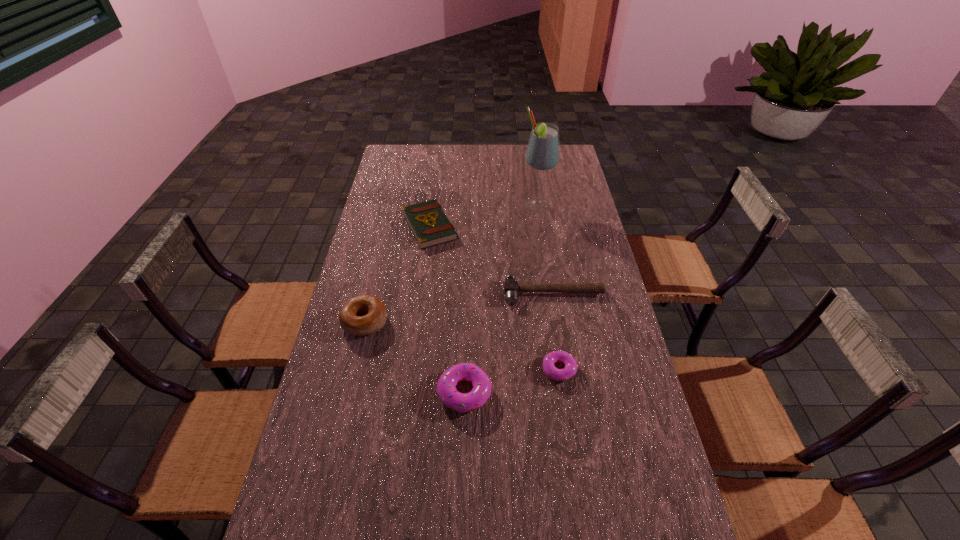
Find the location of a particular element. This screenshot has height=540, width=960. free space at the right edge is located at coordinates (617, 462).

At what (x,y) coordinates should I click in order to perform the action: click on free space at the far left corner of the desktop. Please return your answer as a coordinate pair (x, y). Looking at the image, I should click on pos(420,152).

Where is `free space at the near right corner of the desktop`? Image resolution: width=960 pixels, height=540 pixels. free space at the near right corner of the desktop is located at coordinates (615, 514).

You are a GUI agent. You are given a task and a screenshot of the screen. Output one action in this format:
    pyautogui.click(x=<x>, y=<y>)
    Task: Click on the free spot between the right doughnut and the third tallest object
    This screenshot has width=960, height=540.
    Given the screenshot: What is the action you would take?
    pyautogui.click(x=512, y=381)

You are a GUI agent. You are given a task and a screenshot of the screen. Output one action in this format:
    pyautogui.click(x=<x>, y=<y>)
    Task: Click on the vacant space that's between the bagel and the shorter doughnut
    This screenshot has width=960, height=540.
    Given the screenshot: What is the action you would take?
    pyautogui.click(x=462, y=346)

Identify the location of free space between the shorter doughnut and the third tallest object. The width and height of the screenshot is (960, 540). (512, 381).

The image size is (960, 540). In order to click on unoccupied area between the hammer and the tallest object in this screenshot , I will do `click(545, 249)`.

You are a GUI agent. You are given a task and a screenshot of the screen. Output one action in this format:
    pyautogui.click(x=<x>, y=<y>)
    Task: Click on the free area in between the shorter doughnut and the book
    The height and width of the screenshot is (540, 960).
    Given the screenshot: What is the action you would take?
    click(x=494, y=298)

In order to click on blank region between the shorter doughnut and the left doughnut in this screenshot , I will do click(512, 381).

Where is `free space between the fourth shortest object and the book`? Image resolution: width=960 pixels, height=540 pixels. free space between the fourth shortest object and the book is located at coordinates (447, 309).